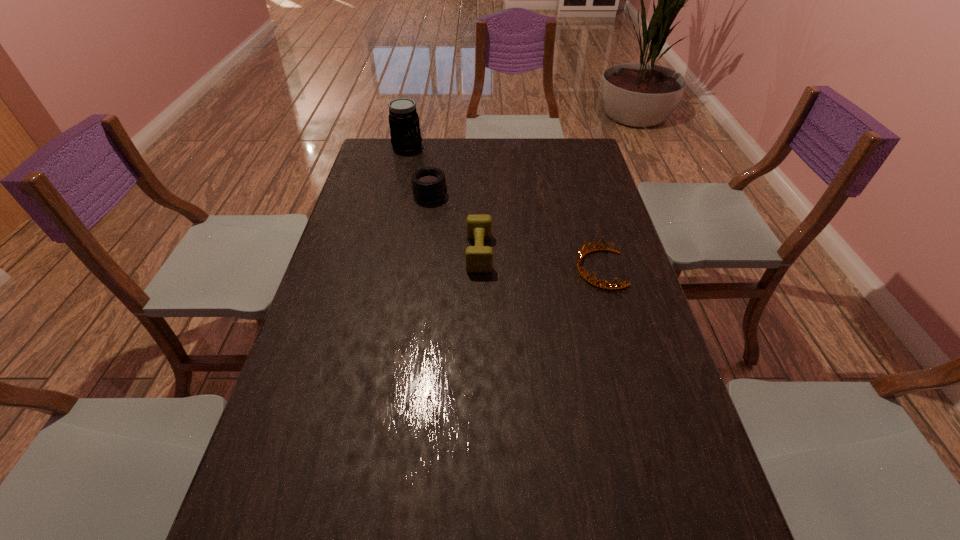
Find the location of `vacant space that is in between the rightmost object and the second farthest object`. vacant space that is in between the rightmost object and the second farthest object is located at coordinates (515, 232).

Identify the location of blank region between the tiara and the shorter telephoto lens. The height and width of the screenshot is (540, 960). (515, 232).

The height and width of the screenshot is (540, 960). I want to click on free spot between the rightmost object and the farthest object, so click(x=503, y=208).

The width and height of the screenshot is (960, 540). Find the location of `empty space between the shorter telephoto lens and the tiara`. empty space between the shorter telephoto lens and the tiara is located at coordinates (515, 232).

Where is `free spot between the second object from right to left and the rightmost object`? free spot between the second object from right to left and the rightmost object is located at coordinates (540, 261).

Locate an element on the screen. object identified as the closest to the shorter telephoto lens is located at coordinates tap(479, 259).

Locate which object ranks second in proximity to the tiara. Please provide its 2D coordinates. Your answer should be formatted as a tuple, i.e. [(x, y)], where the tuple contains the x and y coordinates of a point satisfying the conditions above.

[(428, 184)]

Find the location of a particular element. This screenshot has height=540, width=960. vacant region that satisfies the following two spatial constraints: 1. on the side of the dumbbell with brand markings and control switches; 2. on the left side of the shorter telephoto lens is located at coordinates (422, 253).

The width and height of the screenshot is (960, 540). I want to click on vacant point that satisfies the following two spatial constraints: 1. on the side of the third nearest object with brand markings and control switches; 2. on the right side of the dumbbell, so (422, 253).